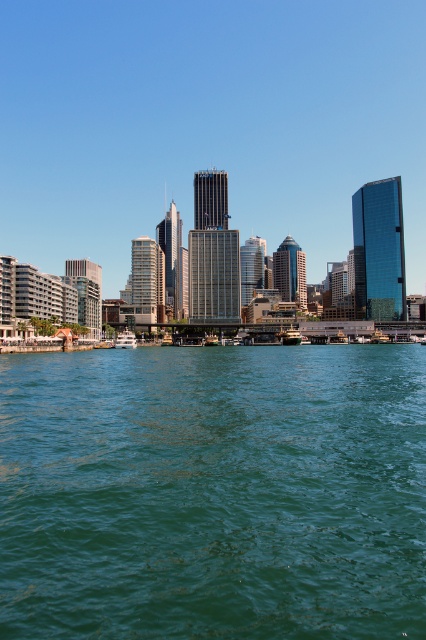
You are standing on the dock and see the green water at lower center and the white glossy boat at center. Which object is located directly above the other?

The white glossy boat at center is positioned above the green water at lower center.

You are a photographer planning to capture the entire scene in one shot. Given that the green water at lower center and the white glossy boat at center are both in your frame, which object occupies a larger portion of the photo?

The green water at lower center occupies a larger portion of the photo since it is bigger than the white glossy boat at center according to the description.

You are standing on the dock and looking at the green water at lower center and the white glossy boat at center. Which object appears taller from your viewpoint?

The green water at lower center appears taller than the white glossy boat at center.